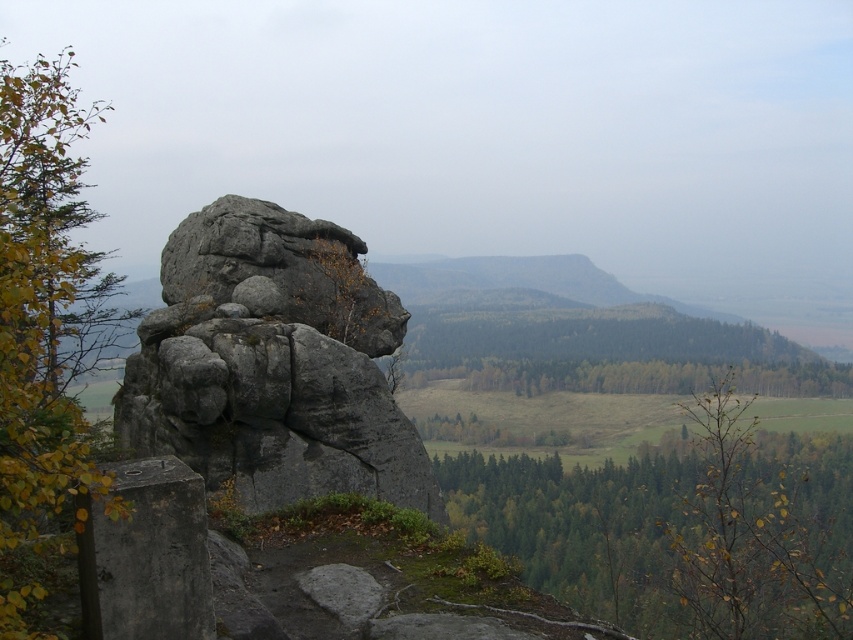
Is green leafy tree at lower center further to camera compared to yellow-green leaves at left?

Yes, green leafy tree at lower center is further from the viewer.

Is point (608, 604) behind point (26, 598)?

Yes, it is behind point (26, 598).

Between point (682, 634) and point (56, 122), which one is positioned in front?

Point (682, 634) is in front.

Locate an element on the screen. green leafy tree at lower center is located at coordinates (679, 528).

Is yellow-green leaves at left further to camera compared to green leafy trees at center?

No, it is in front of green leafy trees at center.

How distant is yellow-green leaves at left from green leafy trees at center?

yellow-green leaves at left and green leafy trees at center are 76.17 meters apart from each other.

Measure the distance between point (33, 467) and camera.

They are 13.17 feet apart.

Identify the location of yellow-green leaves at left. The width and height of the screenshot is (853, 640). (44, 321).

Is gray rough rock at center shorter than green leafy tree at lower center?

Yes.

Between point (254, 244) and point (782, 474), which one is positioned behind?

The point (782, 474) is behind.

Is point (166, 296) positioned behind point (622, 467)?

No.

Identify the location of gray rough rock at center. The width and height of the screenshot is (853, 640). (271, 364).